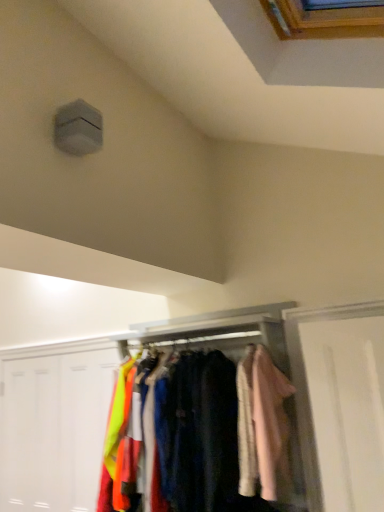
Question: From the image's perspective, relative to neon yellow fabric at lower left, marked as the second door in a left-to-right arrangement, is velvet fabric shirts at center above or below?

Choices:
 (A) below
 (B) above

Answer: (B)

Question: Looking at their shapes, would you say velvet fabric shirts at center is wider or thinner than neon yellow fabric at lower left, placed as the first door when sorted from right to left?

Choices:
 (A) thin
 (B) wide

Answer: (B)

Question: Which of these objects is positioned farthest from the velvet fabric shirts at center?

Choices:
 (A) light pink fabric coat at right
 (B) white matte door at lower left, arranged as the 1th door when viewed from the left
 (C) neon yellow fabric at lower left, placed as the first door when sorted from right to left

Answer: (B)

Question: Estimate the real-world distances between objects in this image. Which object is farther from the light pink fabric coat at right?

Choices:
 (A) velvet fabric shirts at center
 (B) neon yellow fabric at lower left, marked as the second door in a left-to-right arrangement
 (C) white matte door at lower left, arranged as the 1th door when viewed from the left

Answer: (C)